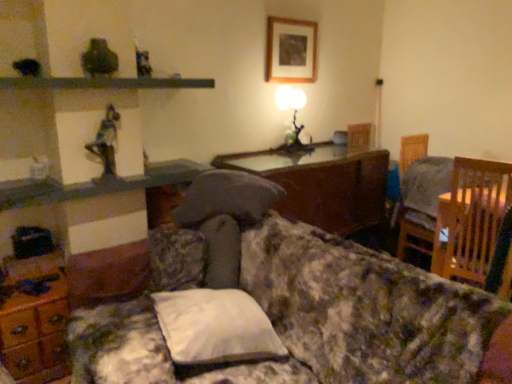
Question: Are wooden dresser at lower left and floral fabric couch at center far apart?

Choices:
 (A) no
 (B) yes

Answer: (A)

Question: Is wooden dresser at lower left next to floral fabric couch at center and touching it?

Choices:
 (A) no
 (B) yes

Answer: (A)

Question: From a real-world perspective, is wooden dresser at lower left on floral fabric couch at center?

Choices:
 (A) yes
 (B) no

Answer: (B)

Question: Is wooden dresser at lower left not inside floral fabric couch at center?

Choices:
 (A) yes
 (B) no

Answer: (A)

Question: Is wooden dresser at lower left at the left side of floral fabric couch at center?

Choices:
 (A) no
 (B) yes

Answer: (B)

Question: Is metallic gray shelf at upper center bigger or smaller than wooden dresser at lower left?

Choices:
 (A) small
 (B) big

Answer: (A)

Question: Would you say metallic gray shelf at upper center is to the left or to the right of wooden dresser at lower left in the picture?

Choices:
 (A) left
 (B) right

Answer: (B)

Question: Is metallic gray shelf at upper center situated inside wooden dresser at lower left or outside?

Choices:
 (A) outside
 (B) inside

Answer: (A)

Question: From the image's perspective, is metallic gray shelf at upper center positioned above or below wooden dresser at lower left?

Choices:
 (A) above
 (B) below

Answer: (A)

Question: From the image's perspective, relative to wooden picture frame at upper center, is white fabric pillow at center above or below?

Choices:
 (A) above
 (B) below

Answer: (B)

Question: Based on their positions, is white fabric pillow at center located to the left or right of wooden picture frame at upper center?

Choices:
 (A) right
 (B) left

Answer: (B)

Question: Is white fabric pillow at center wider or thinner than wooden picture frame at upper center?

Choices:
 (A) wide
 (B) thin

Answer: (A)

Question: Considering the positions of point (256, 349) and point (285, 74), is point (256, 349) closer or farther from the camera than point (285, 74)?

Choices:
 (A) closer
 (B) farther

Answer: (A)

Question: Based on their sizes in the image, would you say wooden glossy table at center is bigger or smaller than matte glass table lamp at center?

Choices:
 (A) big
 (B) small

Answer: (A)

Question: Considering the positions of wooden glossy table at center and matte glass table lamp at center in the image, is wooden glossy table at center wider or thinner than matte glass table lamp at center?

Choices:
 (A) thin
 (B) wide

Answer: (B)